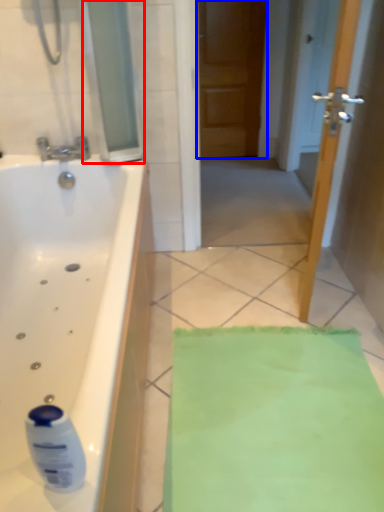
Question: Among these objects, which one is farthest to the camera, glass door (highlighted by a red box) or door (highlighted by a blue box)?

Choices:
 (A) glass door
 (B) door

Answer: (B)